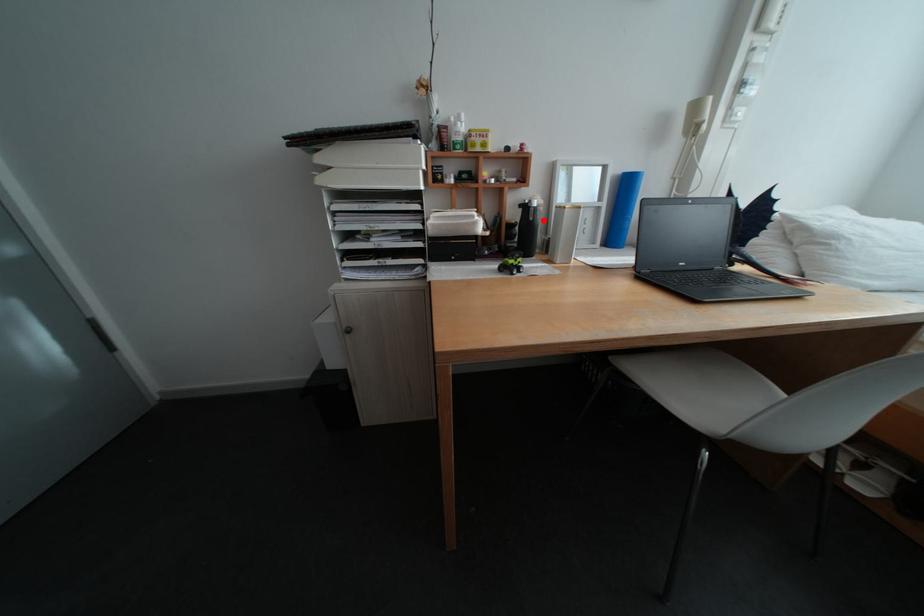
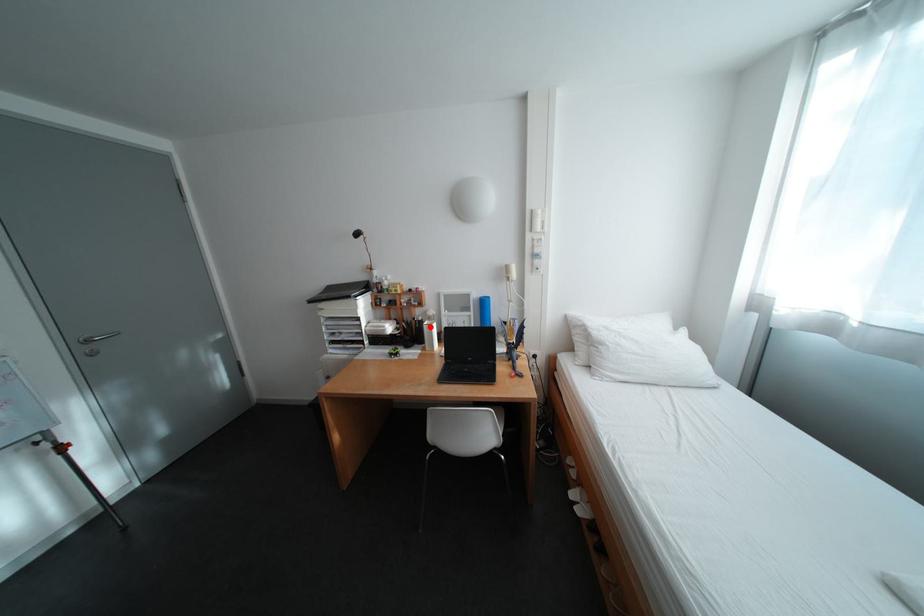
I am providing you with two images of the same scene from different viewpoints. A red point is marked on the first image and another point is marked on the second image. Is the red point in image1 aligned with the point shown in image2?

Yes